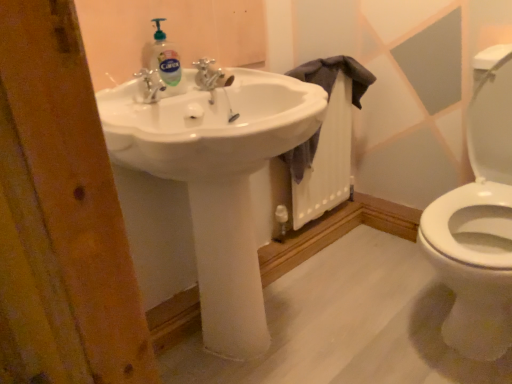
Question: Is dark gray fabric at sink turned away from clear liquid soap at upper center?

Choices:
 (A) no
 (B) yes

Answer: (A)

Question: Considering the relative sizes of dark gray fabric at sink and clear liquid soap at upper center in the image provided, is dark gray fabric at sink shorter than clear liquid soap at upper center?

Choices:
 (A) no
 (B) yes

Answer: (A)

Question: From the image's perspective, is dark gray fabric at sink located beneath clear liquid soap at upper center?

Choices:
 (A) no
 (B) yes

Answer: (B)

Question: Is dark gray fabric at sink beside clear liquid soap at upper center?

Choices:
 (A) no
 (B) yes

Answer: (A)

Question: Does dark gray fabric at sink have a larger size compared to clear liquid soap at upper center?

Choices:
 (A) yes
 (B) no

Answer: (A)

Question: Considering the relative sizes of dark gray fabric at sink and clear liquid soap at upper center in the image provided, is dark gray fabric at sink taller than clear liquid soap at upper center?

Choices:
 (A) no
 (B) yes

Answer: (B)

Question: Is dark gray fabric at sink not inside white glossy sink at center?

Choices:
 (A) no
 (B) yes

Answer: (B)

Question: Is the surface of dark gray fabric at sink in direct contact with white glossy sink at center?

Choices:
 (A) yes
 (B) no

Answer: (B)

Question: Can you confirm if dark gray fabric at sink is wider than white glossy sink at center?

Choices:
 (A) yes
 (B) no

Answer: (B)

Question: Is dark gray fabric at sink facing away from white glossy sink at center?

Choices:
 (A) no
 (B) yes

Answer: (A)

Question: Does dark gray fabric at sink lie behind white glossy sink at center?

Choices:
 (A) yes
 (B) no

Answer: (A)

Question: Considering the relative sizes of dark gray fabric at sink and white glossy sink at center in the image provided, is dark gray fabric at sink bigger than white glossy sink at center?

Choices:
 (A) yes
 (B) no

Answer: (B)

Question: Can you confirm if clear liquid soap at upper center is bigger than silver metallic faucet at center?

Choices:
 (A) yes
 (B) no

Answer: (A)